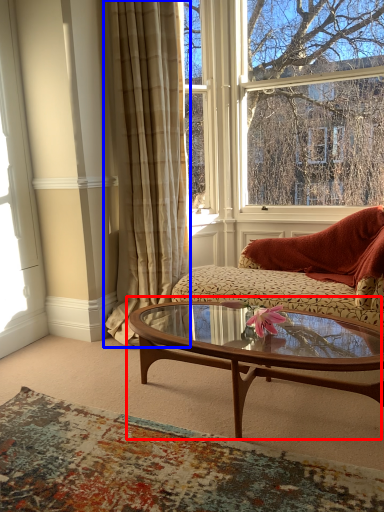
Question: Among these objects, which one is nearest to the camera, coffee table (highlighted by a red box) or curtain (highlighted by a blue box)?

Choices:
 (A) coffee table
 (B) curtain

Answer: (A)